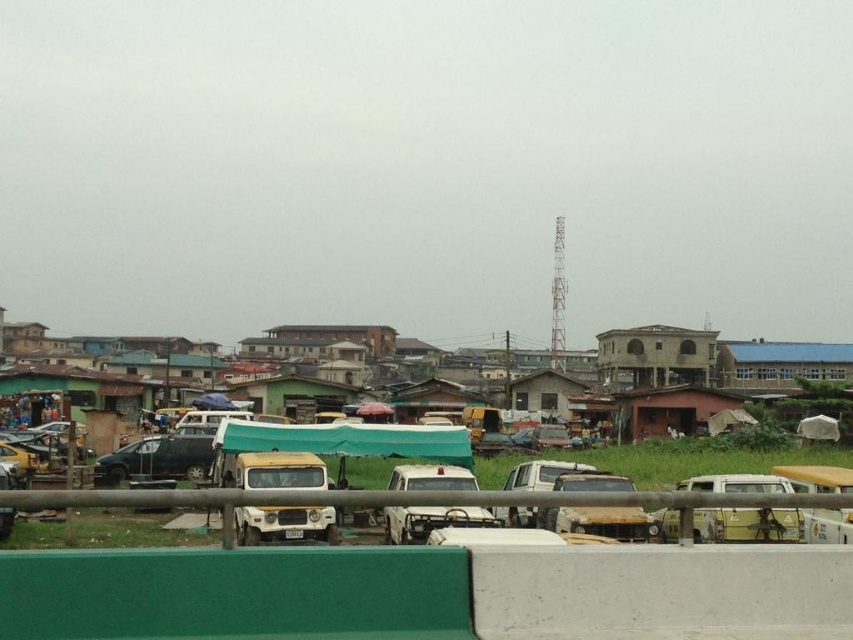
Question: Which object appears closest to the camera in this image?

Choices:
 (A) yellow matte truck at center
 (B) matte black car at center

Answer: (A)

Question: Can you confirm if yellow matte truck at center is bigger than matte black car at center?

Choices:
 (A) yes
 (B) no

Answer: (A)

Question: Is yellow matte truck at center positioned behind matte black car at center?

Choices:
 (A) no
 (B) yes

Answer: (A)

Question: Which object appears closest to the camera in this image?

Choices:
 (A) matte black car at center
 (B) yellow matte truck at center

Answer: (B)

Question: Is the position of yellow matte truck at center less distant than that of matte black car at center?

Choices:
 (A) no
 (B) yes

Answer: (B)